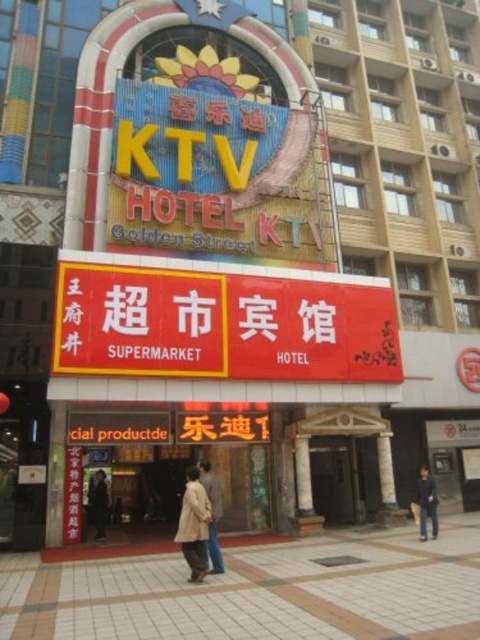
Between point (69, 262) and point (210, 532), which one is positioned behind?

Point (69, 262)

Locate an element on the screen. yellow matte signboard at center is located at coordinates (222, 324).

This screenshot has width=480, height=640. Describe the element at coordinates (215, 172) in the screenshot. I see `yellow plastic ktv sign at upper center` at that location.

Is yellow plastic ktv sign at upper center wider than dark blue jacket at lower right?

Indeed, yellow plastic ktv sign at upper center has a greater width compared to dark blue jacket at lower right.

Does point (256, 209) lie in front of point (421, 540)?

No.

What are the coordinates of `yellow plastic ktv sign at upper center` in the screenshot? It's located at (215, 172).

Can you confirm if yellow plastic ktv sign at upper center is wider than light brown leather jacket at center?

Correct, the width of yellow plastic ktv sign at upper center exceeds that of light brown leather jacket at center.

Does yellow plastic ktv sign at upper center appear on the left side of light brown leather jacket at center?

No, yellow plastic ktv sign at upper center is not to the left of light brown leather jacket at center.

Is point (241, 157) positioned after point (212, 516)?

Yes, it is behind point (212, 516).

Find the location of a particular element. yellow plastic ktv sign at upper center is located at coordinates (215, 172).